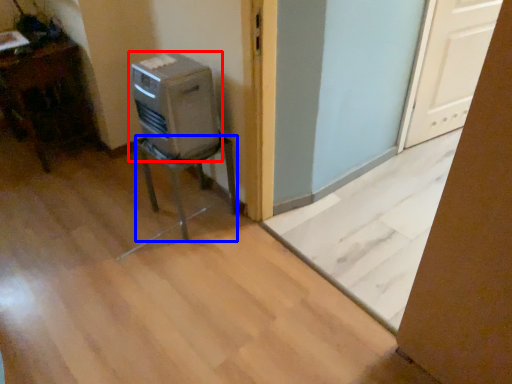
Question: Which point is further to the camera, home appliance (highlighted by a red box) or furniture (highlighted by a blue box)?

Choices:
 (A) home appliance
 (B) furniture

Answer: (B)